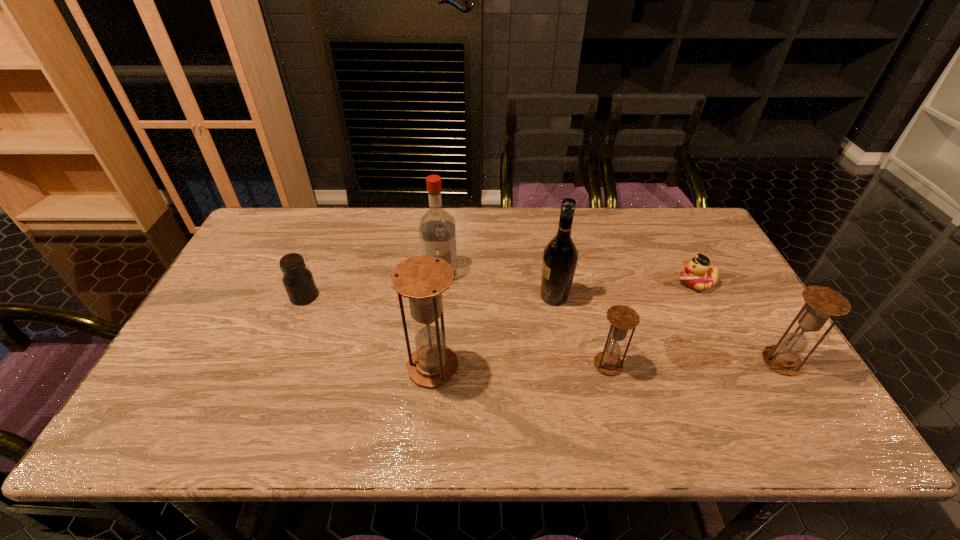
This screenshot has height=540, width=960. I want to click on free space between the duck and the fourth shortest object, so click(x=738, y=322).

Identify the location of free space between the sixth tallest object and the fourth tallest object. (542, 329).

I want to click on vacant region between the liquor and the leftmost object, so (x=372, y=284).

At what (x,y) coordinates should I click in order to perform the action: click on vacant point located between the shortest object and the third object from right to left. Please return your answer as a coordinate pair (x, y). This screenshot has height=540, width=960. Looking at the image, I should click on (652, 323).

In order to click on empty space between the second tallest hourglass and the second shortest object in this screenshot , I will do `click(542, 329)`.

What are the coordinates of `vacant area between the jar and the rightmost hourglass` in the screenshot? It's located at (542, 329).

At what (x,y) coordinates should I click in order to perform the action: click on empty space that is in between the wine bottle and the duck. Please return your answer as a coordinate pair (x, y). The width and height of the screenshot is (960, 540). Looking at the image, I should click on (625, 289).

At what (x,y) coordinates should I click in order to perform the action: click on empty location between the fourth object from right to left and the fourth shortest object. Please return your answer as a coordinate pair (x, y). The width and height of the screenshot is (960, 540). Looking at the image, I should click on [x=667, y=329].

Identify which object is located as the fifth nearest to the second shortest object. Please provide its 2D coordinates. Your answer should be formatted as a tuple, i.e. [(x, y)], where the tuple contains the x and y coordinates of a point satisfying the conditions above.

[(696, 274)]

Locate an element on the screen. This screenshot has width=960, height=540. the fourth closest object to the fourth object from left to right is located at coordinates (696, 274).